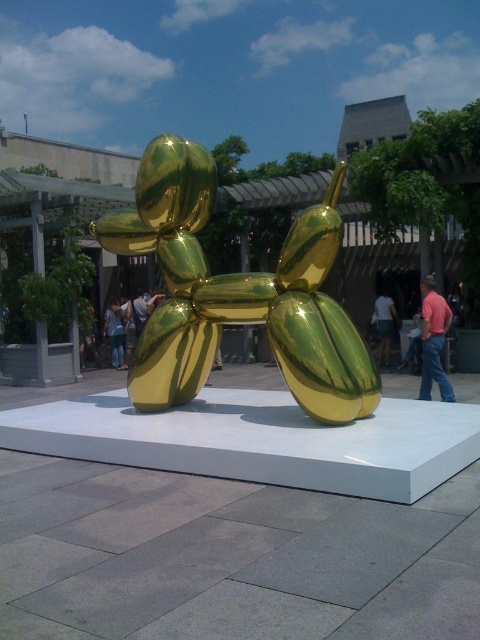
Which is more to the right, white cotton shirt at center or denim pants at lower left?

Positioned to the right is white cotton shirt at center.

Looking at this image, which of these two, white cotton shirt at center or denim pants at lower left, stands shorter?

white cotton shirt at center is shorter.

This screenshot has height=640, width=480. Find the location of `white cotton shirt at center`. white cotton shirt at center is located at coordinates (384, 324).

Consider the image. Can you confirm if pink cotton shirt at center is taller than denim pants at lower left?

Yes.

Can you confirm if pink cotton shirt at center is smaller than denim pants at lower left?

No.

Which is in front, point (450, 317) or point (108, 317)?

Positioned in front is point (450, 317).

In order to click on pink cotton shirt at center in this screenshot , I will do `click(433, 340)`.

Between point (317, 340) and point (108, 336), which one is positioned in front?

Point (317, 340) is more forward.

At what (x,y) coordinates should I click in order to perform the action: click on gold metallic balloon dog at center. Please return your answer as a coordinate pair (x, y). Looking at the image, I should click on (237, 292).